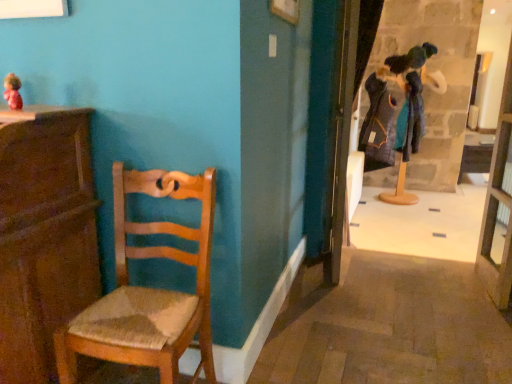
Question: Considering their positions, is wooden cabinet at left located in front of or behind wooden door at center?

Choices:
 (A) behind
 (B) front

Answer: (B)

Question: Which is correct: wooden cabinet at left is inside wooden door at center, or outside of it?

Choices:
 (A) inside
 (B) outside

Answer: (B)

Question: Based on their relative distances, which object is farther from the matte pink doll at upper left?

Choices:
 (A) wooden door at center
 (B) transparent glass door at right
 (C) wooden cabinet at left
 (D) woven wood chair at left

Answer: (B)

Question: Based on their relative distances, which object is farther from the transparent glass door at right?

Choices:
 (A) woven wood chair at left
 (B) matte pink doll at upper left
 (C) wooden door at center
 (D) wooden cabinet at left

Answer: (B)